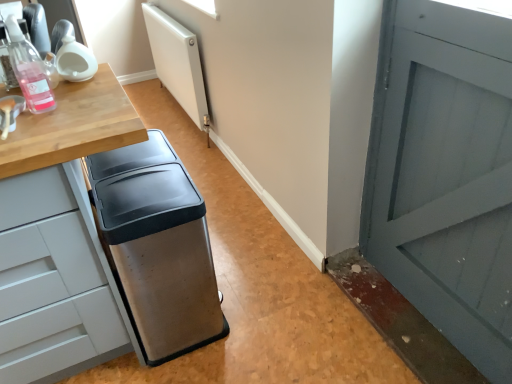
Question: From the image's perspective, is stainless steel trash can at center positioned above or below white matte radiator at upper center?

Choices:
 (A) below
 (B) above

Answer: (A)

Question: Which is correct: stainless steel trash can at center is inside white matte radiator at upper center, or outside of it?

Choices:
 (A) outside
 (B) inside

Answer: (A)

Question: Based on their relative distances, which object is nearer to the translucent plastic bottle at left?

Choices:
 (A) white matte radiator at upper center
 (B) stainless steel trash can at center

Answer: (B)

Question: Which object is the closest to the stainless steel trash can at center?

Choices:
 (A) translucent plastic bottle at left
 (B) white matte radiator at upper center

Answer: (A)